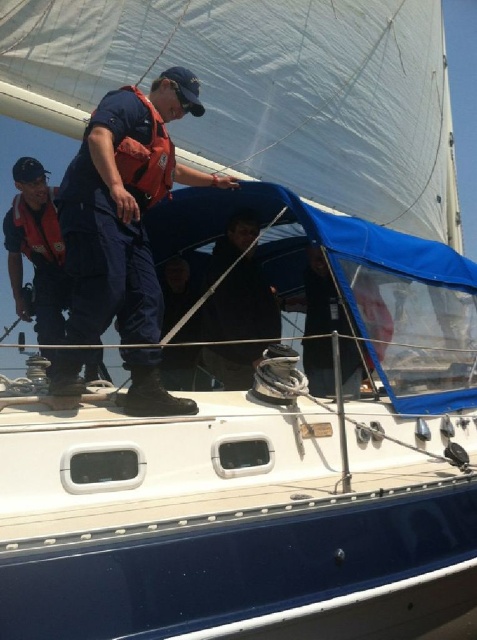
Question: Based on their relative distances, which object is farther from the orange life jacket at left?

Choices:
 (A) blue cotton sailor at center
 (B) orange fabric life jacket at center

Answer: (B)

Question: Can you confirm if blue cotton sailor at center is wider than orange fabric life jacket at center?

Choices:
 (A) no
 (B) yes

Answer: (B)

Question: Does blue cotton sailor at center come behind black matte jacket at center?

Choices:
 (A) no
 (B) yes

Answer: (A)

Question: Does orange fabric life jacket at center have a greater width compared to orange life jacket at left?

Choices:
 (A) no
 (B) yes

Answer: (A)

Question: Estimate the real-world distances between objects in this image. Which object is closer to the blue cotton sailor at center?

Choices:
 (A) black matte jacket at center
 (B) orange fabric life jacket at center
 (C) orange life jacket at left

Answer: (B)

Question: Which object is the farthest from the orange fabric life jacket at center?

Choices:
 (A) blue cotton sailor at center
 (B) orange life jacket at left

Answer: (B)